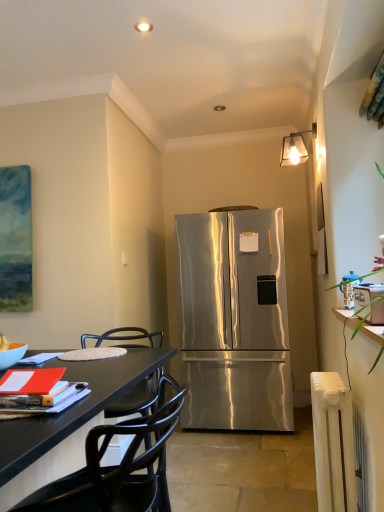
Question: From the image's perspective, would you say black matte chair at lower left is shown under matte orange book at lower left?

Choices:
 (A) no
 (B) yes

Answer: (B)

Question: Is the position of black matte chair at lower left less distant than that of matte orange book at lower left?

Choices:
 (A) no
 (B) yes

Answer: (B)

Question: Is black matte chair at lower left not close to matte orange book at lower left?

Choices:
 (A) yes
 (B) no

Answer: (B)

Question: Is black matte chair at lower left smaller than matte orange book at lower left?

Choices:
 (A) yes
 (B) no

Answer: (B)

Question: From a real-world perspective, is black matte chair at lower left over matte orange book at lower left?

Choices:
 (A) yes
 (B) no

Answer: (B)

Question: Can you see black matte chair at lower left touching matte orange book at lower left?

Choices:
 (A) no
 (B) yes

Answer: (A)

Question: Is the depth of clear glass lampshade at upper center greater than that of white plastic radiator at lower right?

Choices:
 (A) yes
 (B) no

Answer: (A)

Question: From the image's perspective, is clear glass lampshade at upper center below white plastic radiator at lower right?

Choices:
 (A) yes
 (B) no

Answer: (B)

Question: Can you confirm if clear glass lampshade at upper center is taller than white plastic radiator at lower right?

Choices:
 (A) no
 (B) yes

Answer: (A)

Question: Is clear glass lampshade at upper center oriented away from white plastic radiator at lower right?

Choices:
 (A) yes
 (B) no

Answer: (B)

Question: Can you confirm if clear glass lampshade at upper center is positioned to the left of white plastic radiator at lower right?

Choices:
 (A) no
 (B) yes

Answer: (A)

Question: Is white plastic radiator at lower right surrounded by clear glass lampshade at upper center?

Choices:
 (A) no
 (B) yes

Answer: (A)

Question: From the image's perspective, is matte orange book at lower left below stainless steel refrigerator at center?

Choices:
 (A) yes
 (B) no

Answer: (B)